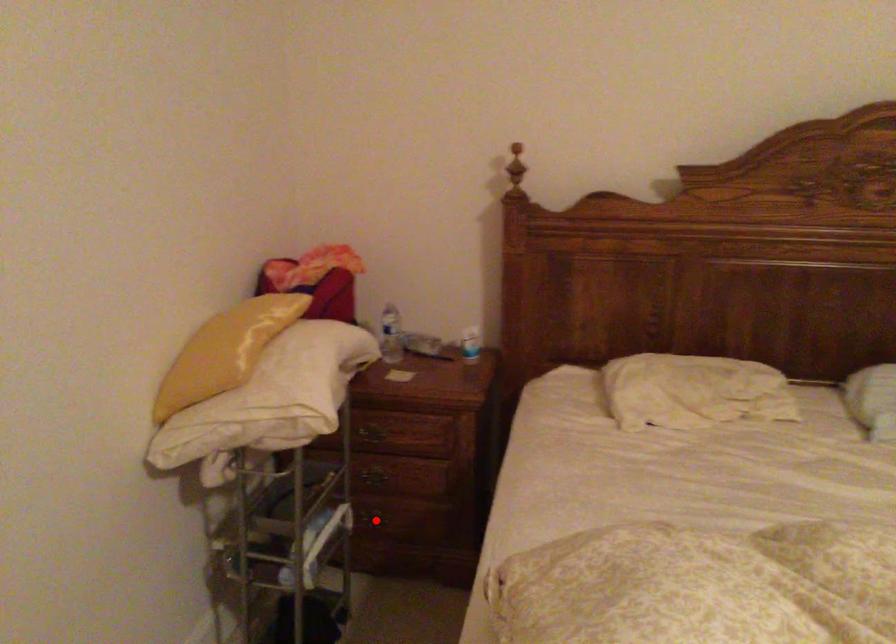
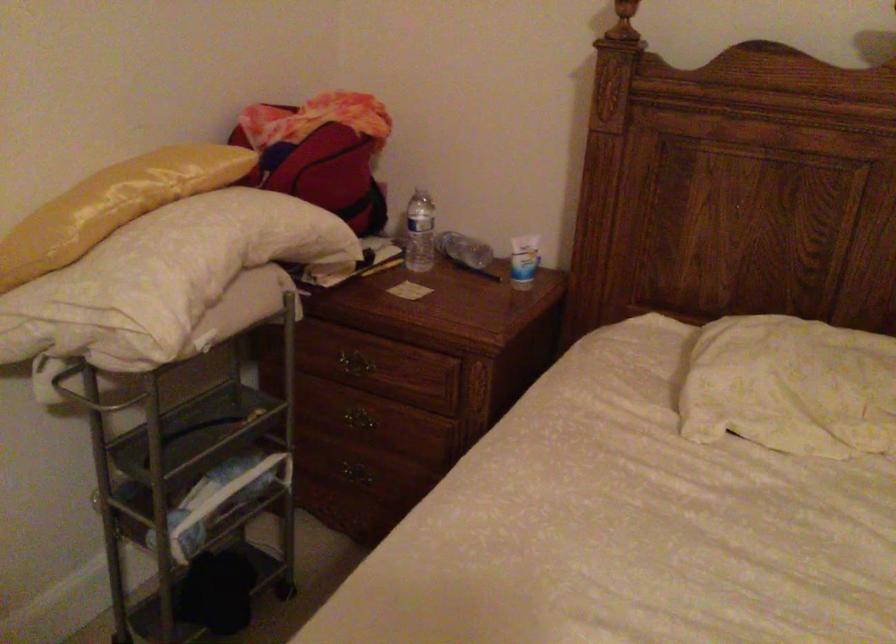
Question: I am providing you with two images of the same scene from different viewpoints. A red point is marked on the first image. Can you still see the location of the red point in image 2?

Choices:
 (A) Yes
 (B) No

Answer: (A)